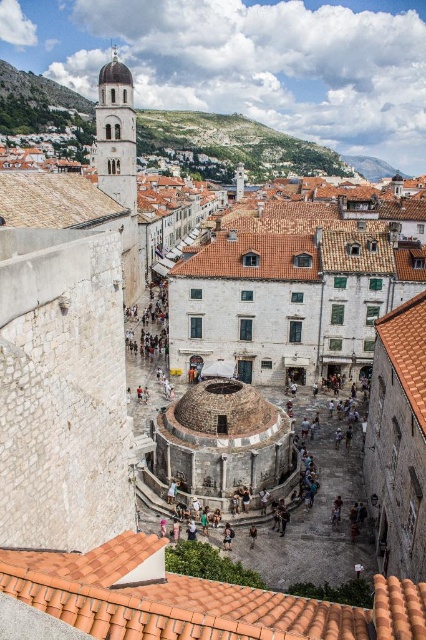
Question: Can you confirm if terracotta tiled roof at upper left is positioned to the right of brown tile roof at center right?

Choices:
 (A) yes
 (B) no

Answer: (B)

Question: Which point is farther from the camera taking this photo?

Choices:
 (A) (402, 332)
 (B) (132, 116)
 (C) (49, 221)

Answer: (B)

Question: Based on their relative distances, which object is farther from the orange tile roof at center?

Choices:
 (A) dark brown leather backpack at center
 (B) brown leather jacket at center

Answer: (B)

Question: Can you confirm if brown tile roof at center right is positioned above dark brown leather backpack at center?

Choices:
 (A) yes
 (B) no

Answer: (A)

Question: Which point is closer to the camera?

Choices:
 (A) (134, 147)
 (B) (340, 609)
 (C) (414, 371)
 (D) (39, 198)

Answer: (B)

Question: Does terracotta tiled roof at upper left have a lesser width compared to dark brown leather backpack at center?

Choices:
 (A) yes
 (B) no

Answer: (B)